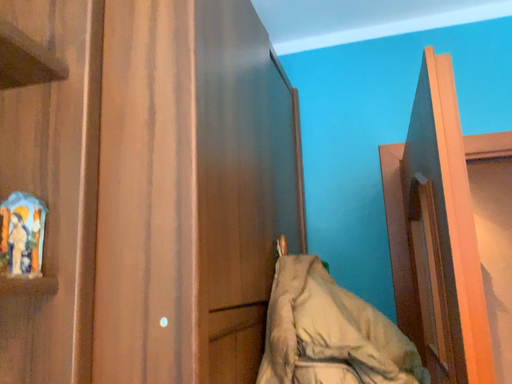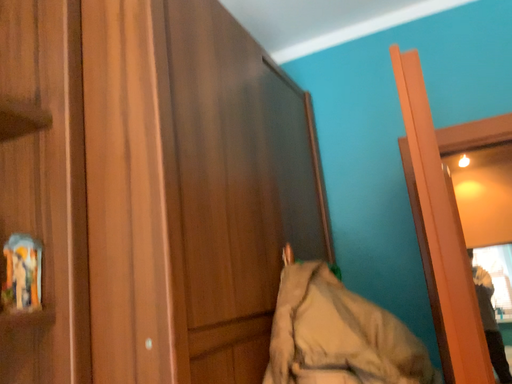
Question: How did the camera likely rotate when shooting the video?

Choices:
 (A) rotated left
 (B) rotated right

Answer: (A)